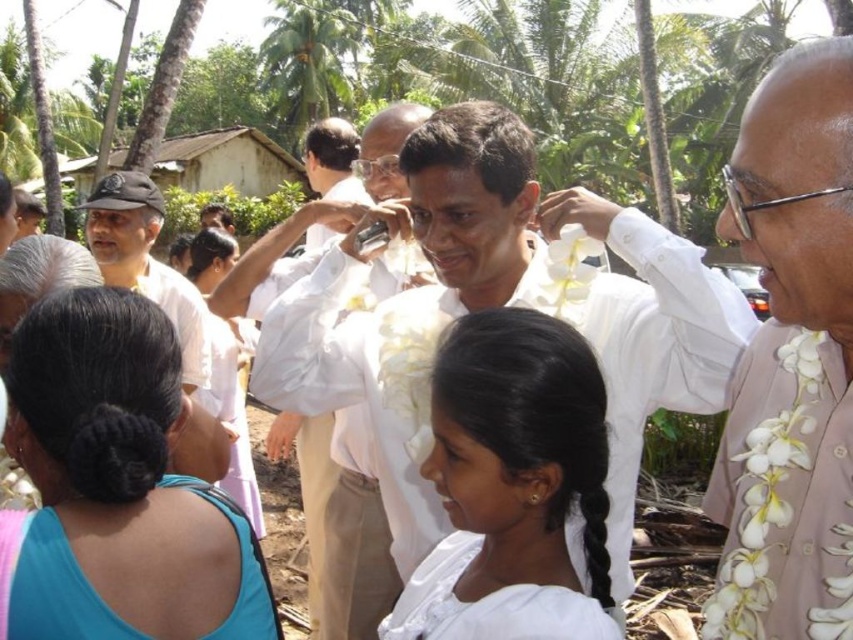
Between blue fabric hair tie at upper left and white fabric at center, which one has less height?

Standing shorter between the two is blue fabric hair tie at upper left.

Is blue fabric hair tie at upper left below white fabric at center?

No.

Does point (109, 324) come farther from viewer compared to point (544, 467)?

No.

Find the location of a particular element. This screenshot has width=853, height=640. blue fabric hair tie at upper left is located at coordinates (115, 486).

Does blue fabric hair tie at upper left lie behind white cloth shirt at center?

No.

Who is lower down, blue fabric hair tie at upper left or white cloth shirt at center?

white cloth shirt at center is below.

Is point (236, 518) positioned after point (322, 556)?

No, it is in front of (322, 556).

In order to click on blue fabric hair tie at upper left in this screenshot , I will do `click(115, 486)`.

Does point (744, 536) come behind point (515, 378)?

Yes, it is.

From the picture: Does light brown textured shirt at right appear on the left side of white fabric at center?

Incorrect, light brown textured shirt at right is not on the left side of white fabric at center.

Is point (836, 358) closer to viewer compared to point (564, 353)?

Yes, it is.

Where is `light brown textured shirt at right`? This screenshot has width=853, height=640. light brown textured shirt at right is located at coordinates (790, 360).